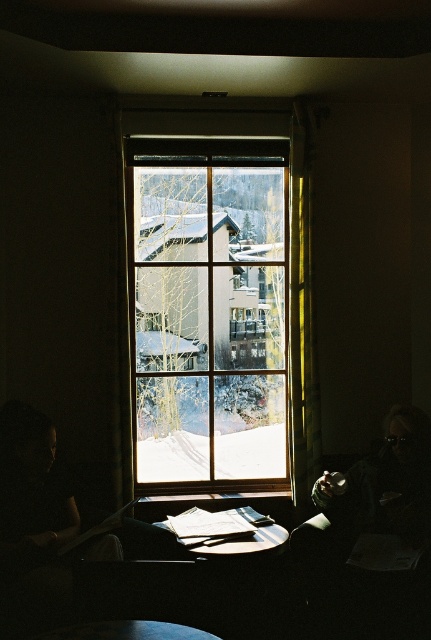
Is clear glass window at center wider than yellow fabric curtain at right?

Correct, the width of clear glass window at center exceeds that of yellow fabric curtain at right.

Describe the element at coordinates (209, 308) in the screenshot. I see `clear glass window at center` at that location.

At what (x,y) coordinates should I click in order to perform the action: click on clear glass window at center. Please return your answer as a coordinate pair (x, y). The height and width of the screenshot is (640, 431). Looking at the image, I should click on (209, 308).

Can you confirm if yellow fabric curtain at right is positioned to the right of wooden table at center?

Yes, yellow fabric curtain at right is to the right of wooden table at center.

Can you confirm if yellow fabric curtain at right is wider than wooden table at center?

No.

Who is more forward, (293,483) or (237,520)?

Point (237,520) is more forward.

At what (x,y) coordinates should I click in order to perform the action: click on yellow fabric curtain at right. Please return your answer as a coordinate pair (x, y). Looking at the image, I should click on (302, 317).

What do you see at coordinates (209, 308) in the screenshot? This screenshot has width=431, height=640. I see `clear glass window at center` at bounding box center [209, 308].

Who is more forward, (175, 346) or (255, 520)?

Positioned in front is point (255, 520).

Between point (140, 346) and point (196, 509), which one is positioned in front?

Positioned in front is point (196, 509).

Locate an element on the screen. clear glass window at center is located at coordinates (209, 308).